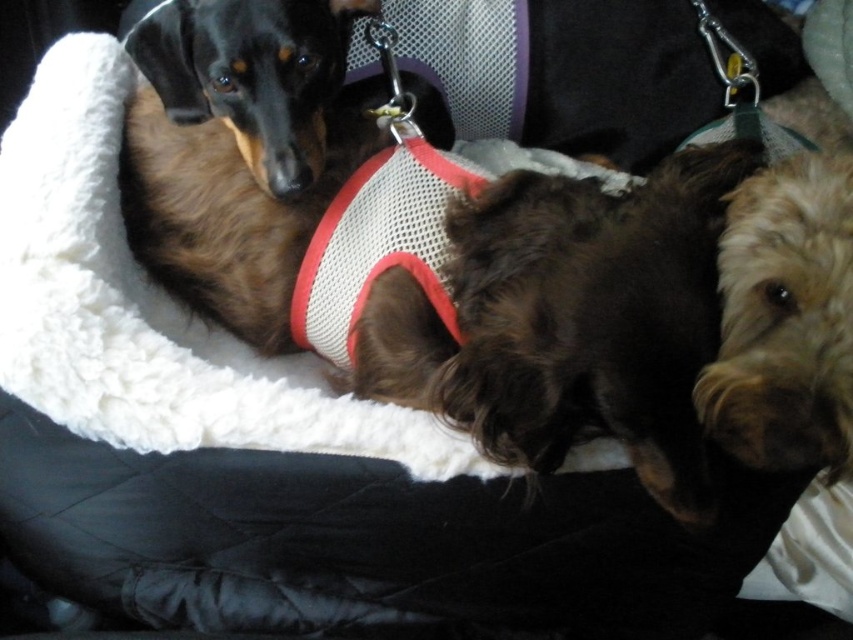
You are a dog owner who wants to ensure the safety of your pets while traveling. Looking at the image, can you confirm if the mesh fabric harness at center is properly secured on the brown fur dog at upper left?

The mesh fabric harness at center is positioned over brown fur dog at upper left, which means it is placed on top of the dog but not necessarily secured. To ensure proper safety, the harness should be fastened around the dog to keep it in place during travel.

You are a photographer trying to capture a closeup shot of the point at coordinates point (x=688, y=84) and point (x=329, y=147). Which point is closer to the camera?

Point (x=688, y=84) is further to the camera than point (x=329, y=147), so the point at (x=329, y=147) is closer to the camera.

In the scene shown: You are a photographer trying to capture a closeup of the mesh fabric harness at center and the brown fur dog at upper left. Which object is closer to the camera?

The mesh fabric harness at center is closer to the camera than the brown fur dog at upper left because it is further to the viewer.